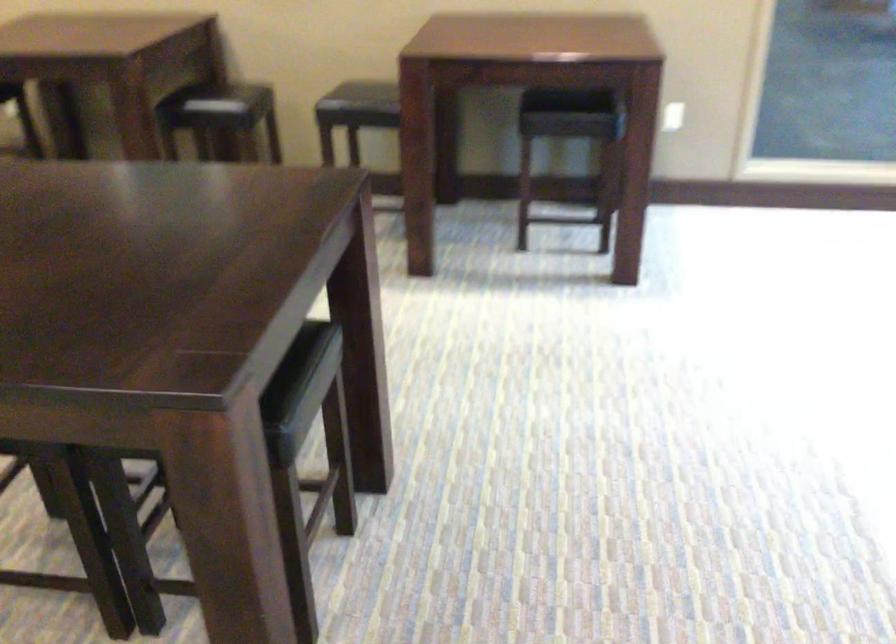
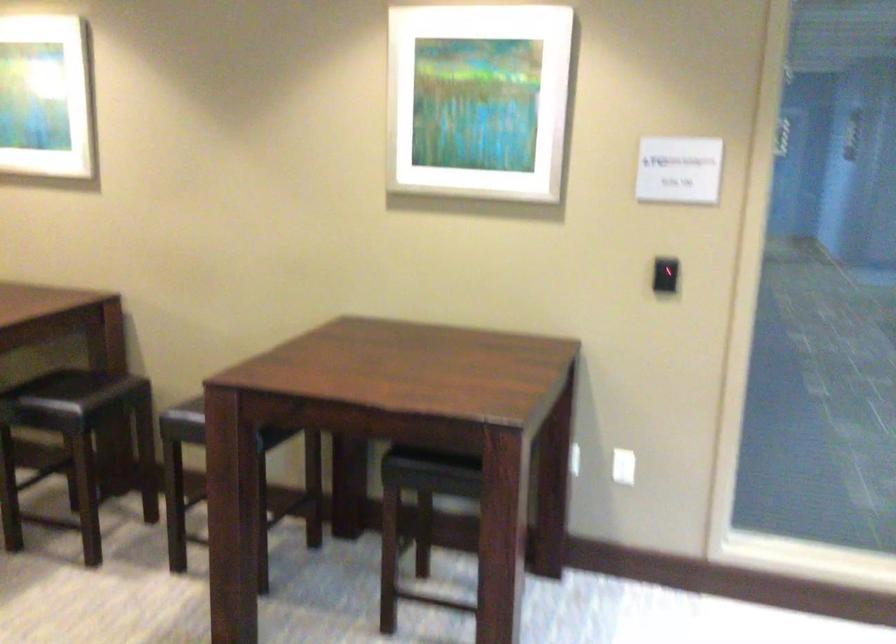
The images are taken continuously from a first-person perspective. In which direction are you moving?

The movement direction of the cameraman is right, forward.